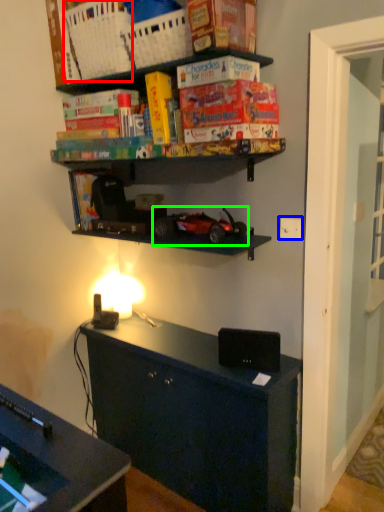
Question: Which object is positioned closest to basket (highlighted by a red box)? Select from electric outlet (highlighted by a blue box) and model car (highlighted by a green box).

Choices:
 (A) electric outlet
 (B) model car

Answer: (B)